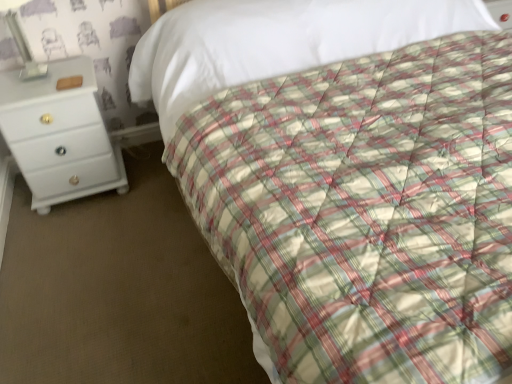
The width and height of the screenshot is (512, 384). In order to click on free space above white glossy chest of drawers at left (from a real-world perspective) in this screenshot , I will do `click(39, 74)`.